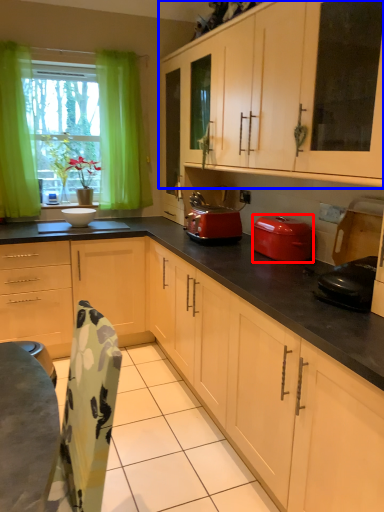
Question: Which object is further to the camera taking this photo, kitchen appliance (highlighted by a red box) or cabinetry (highlighted by a blue box)?

Choices:
 (A) kitchen appliance
 (B) cabinetry

Answer: (A)